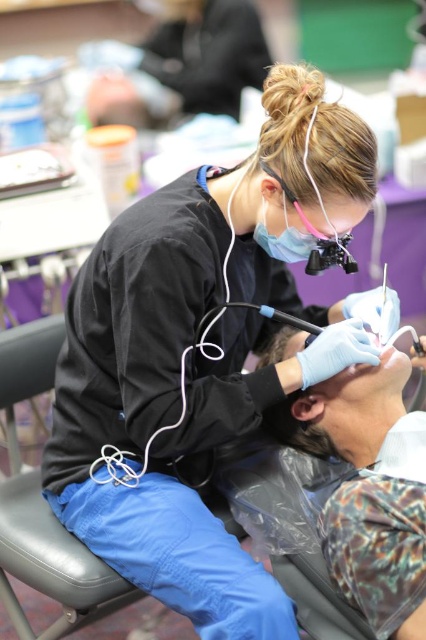
Question: Which point is closer to the camera?

Choices:
 (A) matte blue shirt at center
 (B) black leather chair at lower left

Answer: (A)

Question: Does matte blue shirt at center appear on the right side of black leather chair at lower left?

Choices:
 (A) yes
 (B) no

Answer: (A)

Question: Which point is farther to the camera?

Choices:
 (A) matte blue shirt at center
 (B) black leather chair at lower left

Answer: (B)

Question: Which object is farther from the camera taking this photo?

Choices:
 (A) black leather chair at lower left
 (B) matte blue shirt at center

Answer: (A)

Question: In this image, where is matte blue shirt at center located relative to black leather chair at lower left?

Choices:
 (A) above
 (B) below

Answer: (A)

Question: From the image, what is the correct spatial relationship of matte blue shirt at center in relation to black leather chair at lower left?

Choices:
 (A) below
 (B) above

Answer: (B)